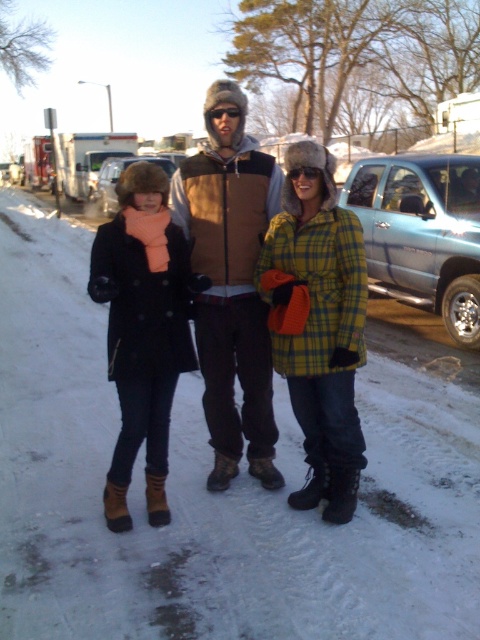
Based on their positions in the snowy scene, which object is located to the right of the other between the brown suede vest at center and the matte black coat at left?

The brown suede vest at center is located to the right of the matte black coat at left.

Based on the photo, you are standing at the point marked as point (136, 225) and want to walk to the point marked as point (239, 90). Which direction should you move relative to your current position?

You should move backward because point (239, 90) is behind point (136, 225).